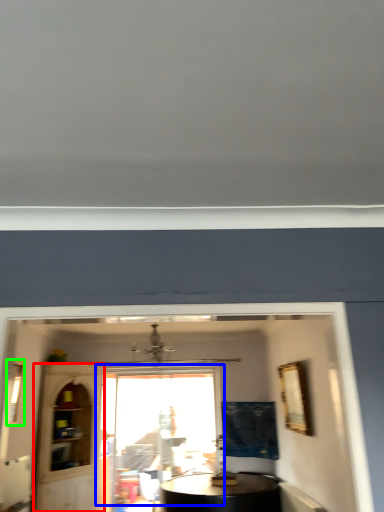
Question: Which is nearer to the glass door (highlighted by a red box)? window (highlighted by a blue box) or window (highlighted by a green box).

Choices:
 (A) window
 (B) window

Answer: (A)